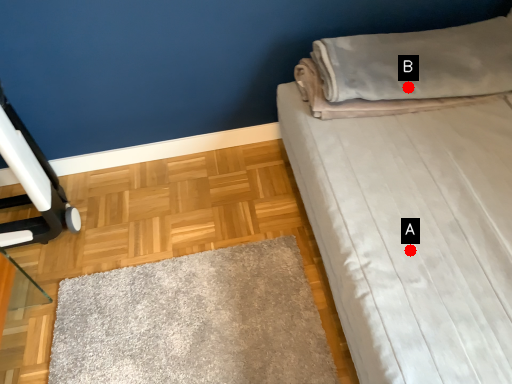
Question: Two points are circled on the image, labeled by A and B beside each circle. Which of the following is the farthest from the observer?

Choices:
 (A) A is further
 (B) B is further

Answer: (B)